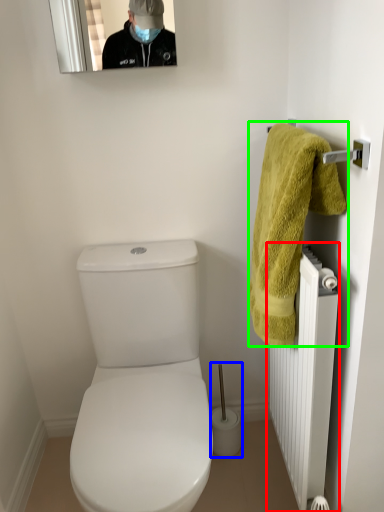
Question: Based on their relative distances, which object is farther from radiator (highlighted by a red box)? Choose from brush (highlighted by a blue box) and towel (highlighted by a green box).

Choices:
 (A) brush
 (B) towel

Answer: (A)